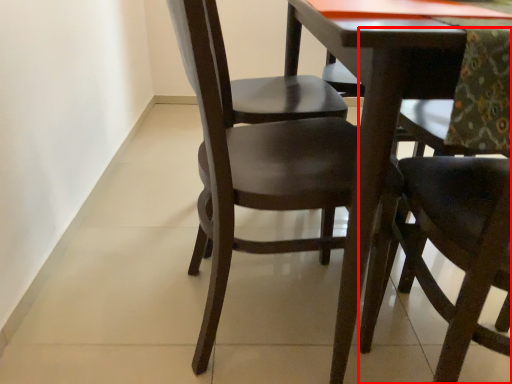
Question: From the image's perspective, what is the correct spatial relationship of chair (annotated by the red box) in relation to chair?

Choices:
 (A) above
 (B) below

Answer: (B)